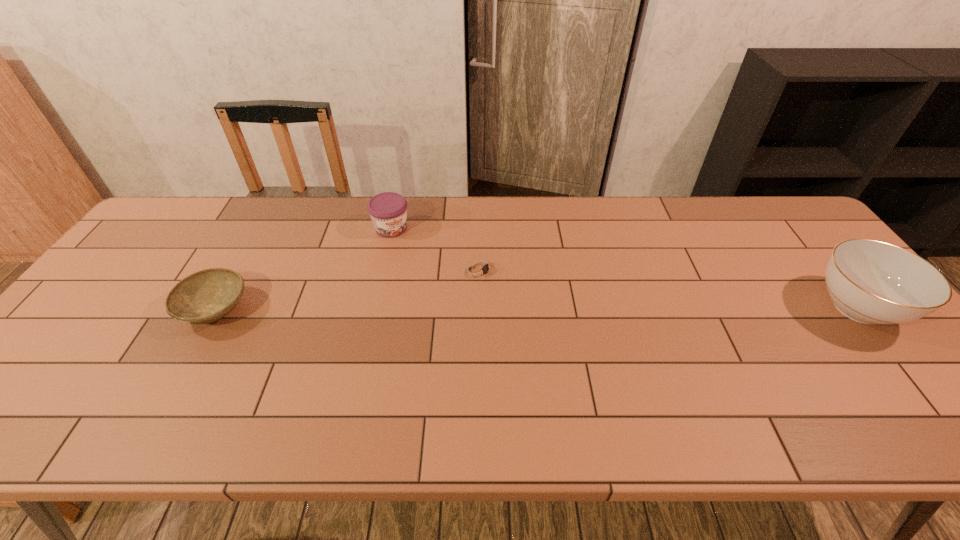
In the image, there is a desktop. Where is `free space at the left edge`? This screenshot has width=960, height=540. free space at the left edge is located at coordinates (95, 332).

This screenshot has height=540, width=960. In the image, there is a desktop. Find the location of `free space at the right edge`. free space at the right edge is located at coordinates (833, 338).

Identify the location of free space at the far right corner of the desktop. (763, 225).

Locate an element on the screen. vacant space that is in between the second shortest object and the shortest object is located at coordinates (348, 289).

Where is `vacant area that lies between the second tallest object and the bowl`? The image size is (960, 540). vacant area that lies between the second tallest object and the bowl is located at coordinates [303, 269].

Find the location of a particular element. The image size is (960, 540). empty location between the second shortest object and the farthest object is located at coordinates (303, 269).

The image size is (960, 540). Identify the location of free point between the farthest object and the shortest object. (436, 249).

I want to click on free spot between the second object from right to left and the jam, so click(x=436, y=249).

The image size is (960, 540). Identify the location of vacant area that lies between the rightmost object and the third object from left to right. (668, 288).

This screenshot has height=540, width=960. I want to click on vacant region between the second shortest object and the jam, so click(303, 269).